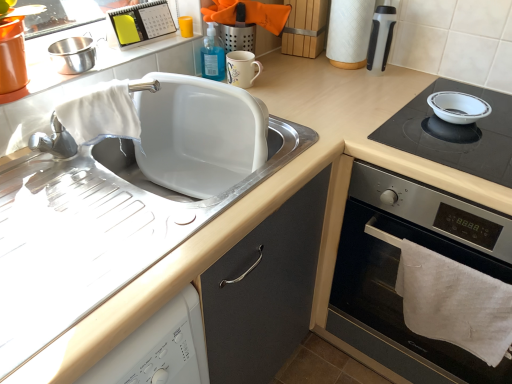
You are a GUI agent. You are given a task and a screenshot of the screen. Output one action in this format:
    pyautogui.click(x=<x>, y=<y>)
    Task: Click on the unoccupied region to the right of white paper towel at upper right
    
    Given the screenshot: What is the action you would take?
    pyautogui.click(x=398, y=81)